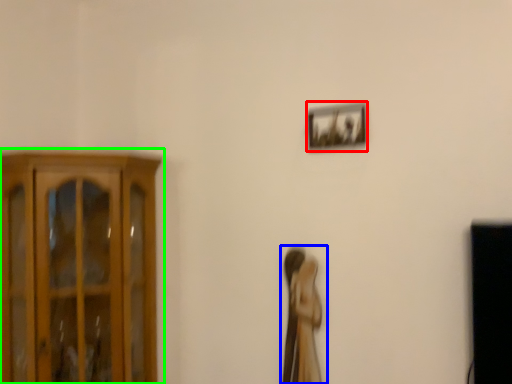
Question: Which is nearer to the picture frame (highlighted by a red box)? woman (highlighted by a blue box) or cupboard (highlighted by a green box).

Choices:
 (A) woman
 (B) cupboard

Answer: (A)